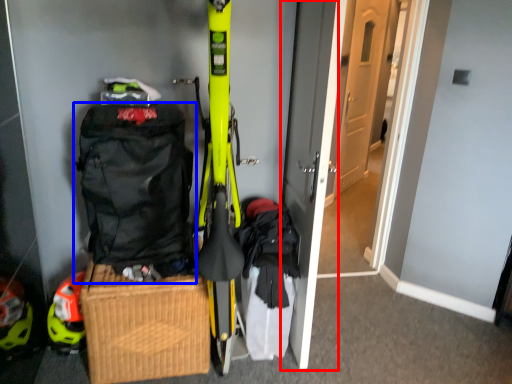
Question: Which object appears farthest to the camera in this image, door (highlighted by a red box) or backpack (highlighted by a blue box)?

Choices:
 (A) door
 (B) backpack

Answer: (B)